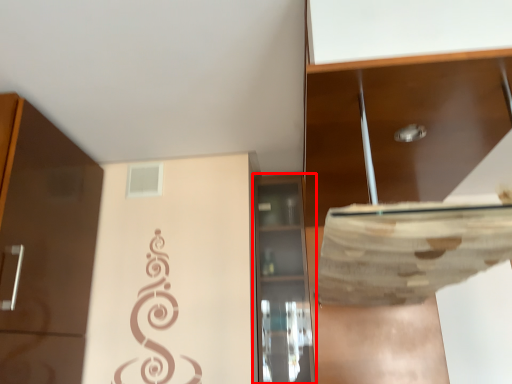
Question: Where is cabinetry (annotated by the red box) located in relation to cabinetry in the image?

Choices:
 (A) right
 (B) left

Answer: (B)